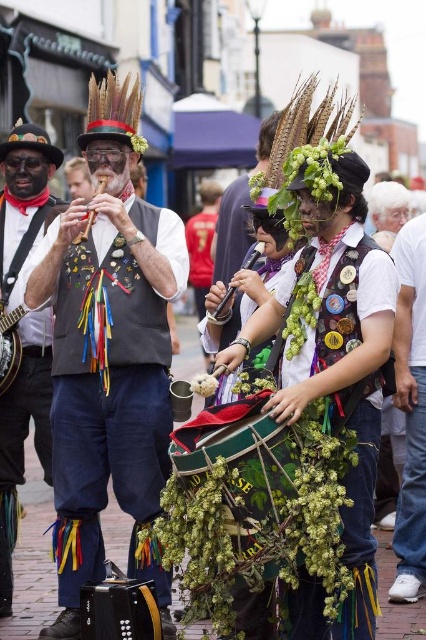
You are a street performer who needs to place both the matte black banjo at left and the metallic accordion at left into a storage case that can only accommodate one of them. Based on their widths, which instrument should you choose to fit into the case?

The matte black banjo at left might be wider than the metallic accordion at left, so it is more likely to fit into the storage case if the case is designed for the wider instrument. However, if the case is meant for the narrower one, the metallic accordion at left would be the better choice.

You are a photographer trying to capture both the matte black vest at center and the brushed metal flute at upper left in a single frame. Given their sizes, which object should you focus on to ensure both fit clearly in the photo?

The matte black vest at center is bigger than the brushed metal flute at upper left, so focusing on the matte black vest at center would allow both objects to fit clearly in the frame since it occupies more space.